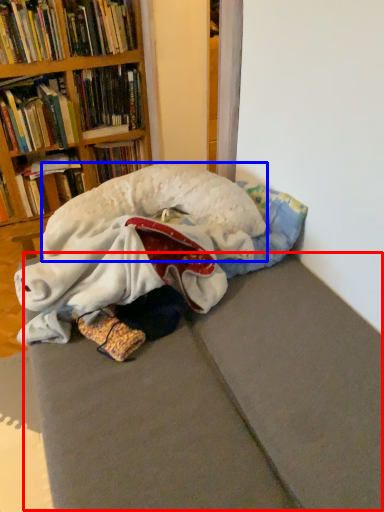
Question: Which object is further to the camera taking this photo, bed frame (highlighted by a red box) or animal (highlighted by a blue box)?

Choices:
 (A) bed frame
 (B) animal

Answer: (B)